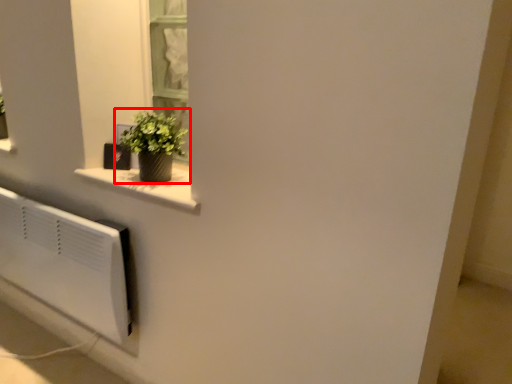
Question: From the image's perspective, what is the correct spatial positioning of houseplant (annotated by the red box) in reference to window sill?

Choices:
 (A) above
 (B) below

Answer: (A)